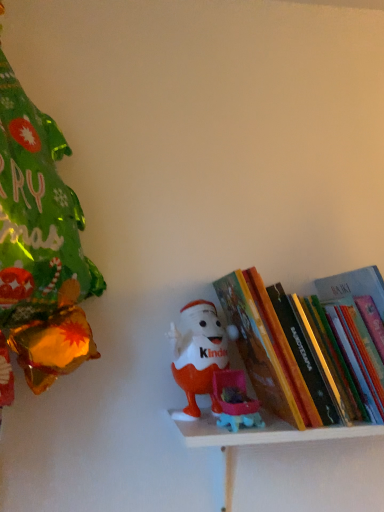
Question: Does plastic toy at center have a smaller size compared to matte plastic toy at center?

Choices:
 (A) no
 (B) yes

Answer: (A)

Question: Would you say matte plastic toy at center is part of plastic toy at center's contents?

Choices:
 (A) no
 (B) yes

Answer: (A)

Question: Can you confirm if plastic toy at center is shorter than matte plastic toy at center?

Choices:
 (A) yes
 (B) no

Answer: (A)

Question: Is plastic toy at center not within matte plastic toy at center?

Choices:
 (A) no
 (B) yes

Answer: (B)

Question: Can you see plastic toy at center touching matte plastic toy at center?

Choices:
 (A) yes
 (B) no

Answer: (A)

Question: Is plastic toy at center not near matte plastic toy at center?

Choices:
 (A) no
 (B) yes

Answer: (A)

Question: From the image's perspective, is hardcover book at center located beneath plastic toy at center?

Choices:
 (A) no
 (B) yes

Answer: (A)

Question: Is hardcover book at center thinner than plastic toy at center?

Choices:
 (A) yes
 (B) no

Answer: (B)

Question: Is hardcover book at center to the right of plastic toy at center from the viewer's perspective?

Choices:
 (A) no
 (B) yes

Answer: (B)

Question: Considering the relative sizes of hardcover book at center and plastic toy at center in the image provided, is hardcover book at center bigger than plastic toy at center?

Choices:
 (A) no
 (B) yes

Answer: (B)

Question: Is hardcover book at center at the left side of plastic toy at center?

Choices:
 (A) yes
 (B) no

Answer: (B)

Question: Could plastic toy at center be considered to be inside hardcover book at center?

Choices:
 (A) yes
 (B) no

Answer: (B)

Question: From the image's perspective, is hardcover book at center beneath matte plastic toy at center?

Choices:
 (A) yes
 (B) no

Answer: (B)